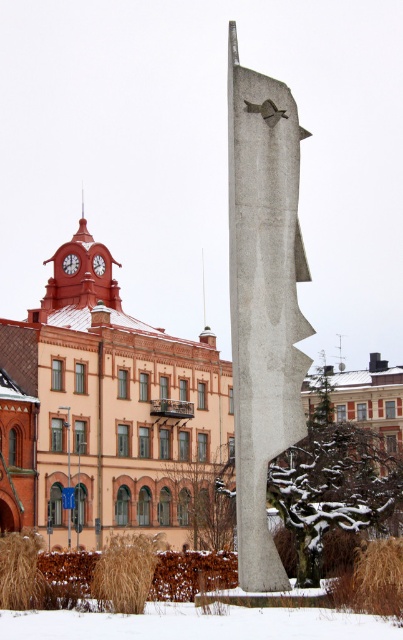
You are standing in the urban scene described. You notice a point at coordinates [70,262]. What object is located there?

The red painted metal clock at center is located at point [70,262].

You are standing at the base of the modern sculpture and want to take a photo of the point at coordinates (380, 570). If your camera has a maximum zoom range of 45 meters, will you be able to capture the point clearly?

The point at coordinates (380, 570) is 44.98 meters from the camera, which is within the camera maximum zoom range of 45 meters. Therefore, you can capture the point clearly.

You are a gardener who needs to plant a new flower bed. You have a space that can accommodate either the brown grass at lower right or the red painted metal clock at center. Based on their sizes, which one would you choose for the flower bed if you want to maximize the area?

The brown grass at lower right might be wider than the red painted metal clock at center, so you should choose the brown grass at lower right to maximize the area for the flower bed.